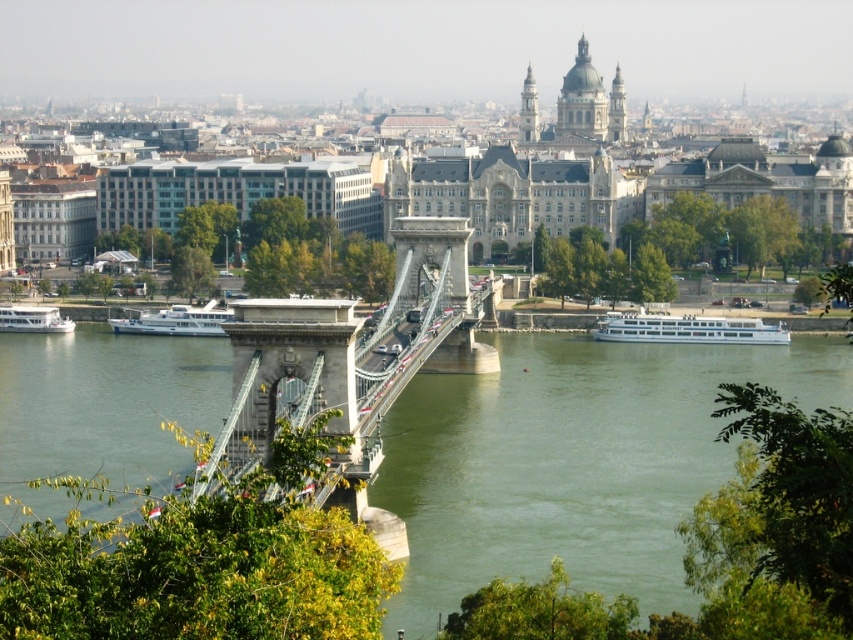
Who is higher up, white glossy boat at lower right or white glossy boat at center?

white glossy boat at lower right is higher up.

Does white glossy boat at lower right lie behind white glossy boat at center?

No, white glossy boat at lower right is in front of white glossy boat at center.

What do you see at coordinates (686, 328) in the screenshot?
I see `white glossy boat at lower right` at bounding box center [686, 328].

Where is `white glossy boat at lower right`? The height and width of the screenshot is (640, 853). white glossy boat at lower right is located at coordinates (686, 328).

What do you see at coordinates (686, 328) in the screenshot? This screenshot has width=853, height=640. I see `white glossy boat at lower right` at bounding box center [686, 328].

Can you confirm if white glossy boat at lower right is positioned to the left of white glossy boat at lower left?

No, white glossy boat at lower right is not to the left of white glossy boat at lower left.

Who is more distant from viewer, (666, 330) or (3, 308)?

Positioned behind is point (3, 308).

You are a GUI agent. You are given a task and a screenshot of the screen. Output one action in this format:
    pyautogui.click(x=<x>, y=<y>)
    Task: Click on the white glossy boat at lower right
    
    Given the screenshot: What is the action you would take?
    point(686,328)

The height and width of the screenshot is (640, 853). What are the coordinates of `greenish water at center` in the screenshot? It's located at (573, 456).

What do you see at coordinates (573, 456) in the screenshot? I see `greenish water at center` at bounding box center [573, 456].

What are the coordinates of `greenish water at center` in the screenshot? It's located at (573, 456).

This screenshot has height=640, width=853. I want to click on greenish water at center, so click(573, 456).